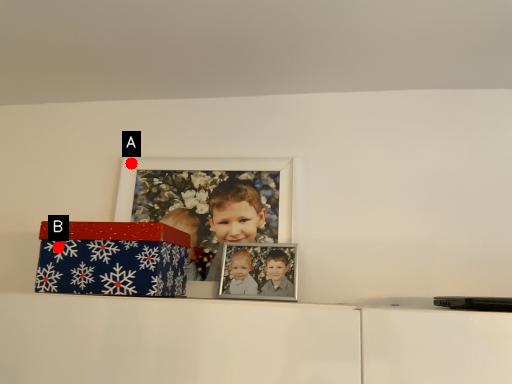
Question: Two points are circled on the image, labeled by A and B beside each circle. Among these points, which one is nearest to the camera?

Choices:
 (A) A is closer
 (B) B is closer

Answer: (B)